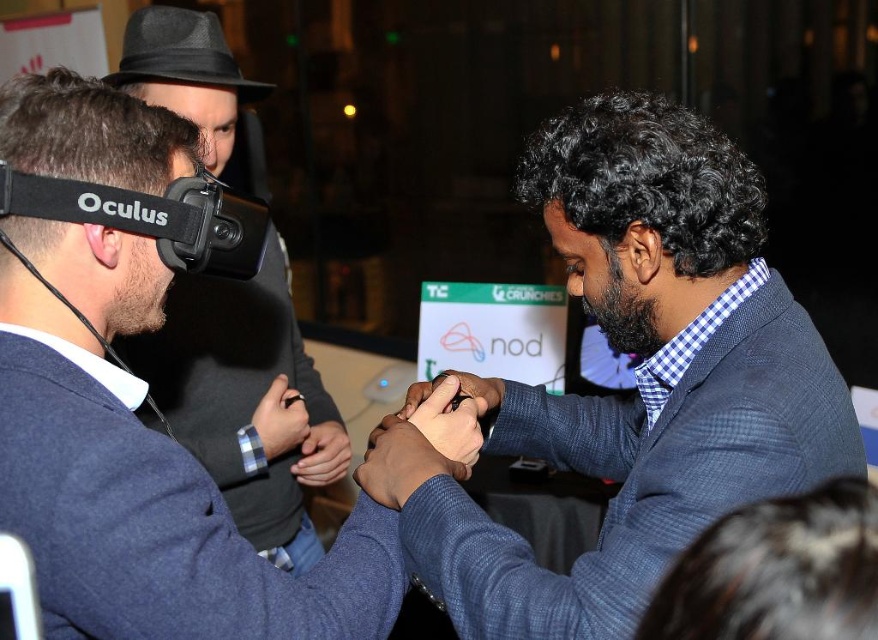
You are a photographer at the event and need to capture a closeup shot of the blue textured suit at center without the camera being visible in the reflection of the VR headset. Can you position yourself close enough to the suit while keeping the camera hidden from the headset?

The blue textured suit at center and camera are 34.22 inches apart from each other. Since the distance between them is 34.22 inches, you can position the camera close enough to the suit while ensuring it stays out of the headset reflection by maintaining this distance.

Consider the image. You are a security guard at the event and need to check the distance between the matte black vr headset at left and the dark blue fabric at lower right. Can you confirm if the distance is less than 1.5 meters?

The matte black vr headset at left is 1.21 meters from the dark blue fabric at lower right, so yes, the distance is less than 1.5 meters.

You are a photographer at the event and need to capture a photo of both the blue textured suit at center and the blue sweater at center. Based on their positions, which one is more to the left?

The blue textured suit at center is wider than the blue sweater at center, but the question asks about their positions. The description does not provide information about their left or right positioning, so it cannot be determined which is more to the left.